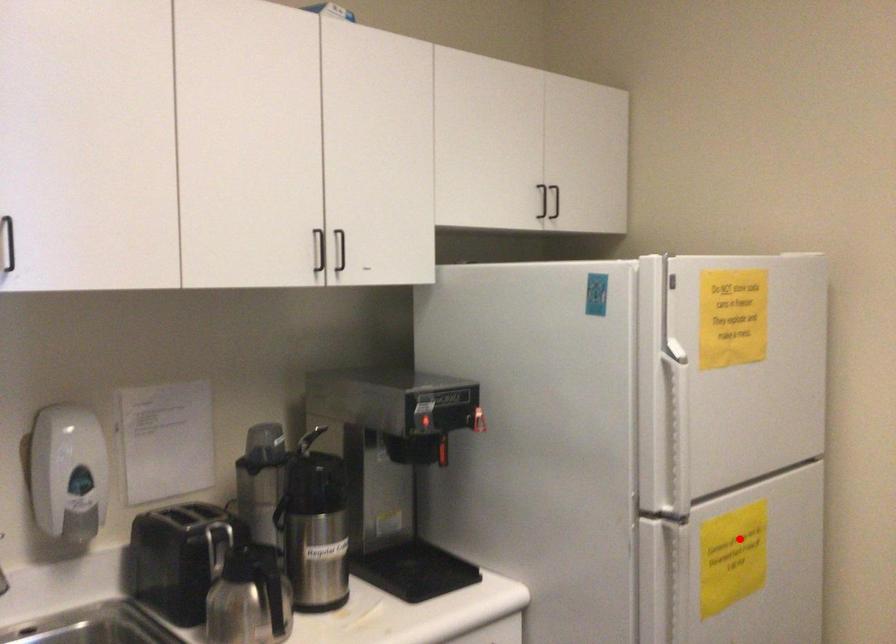
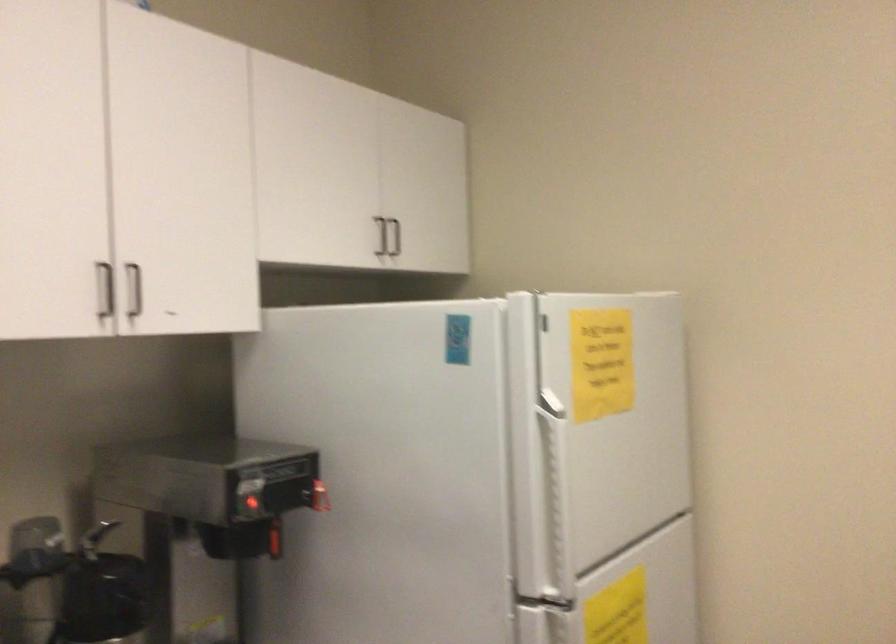
Question: I am providing you with two images of the same scene from different viewpoints. Image1 has a red point marked. In image2, the corresponding 3D location appears at what relative position? Reply with the corresponding letter.

Choices:
 (A) Closer
 (B) Farther

Answer: (A)